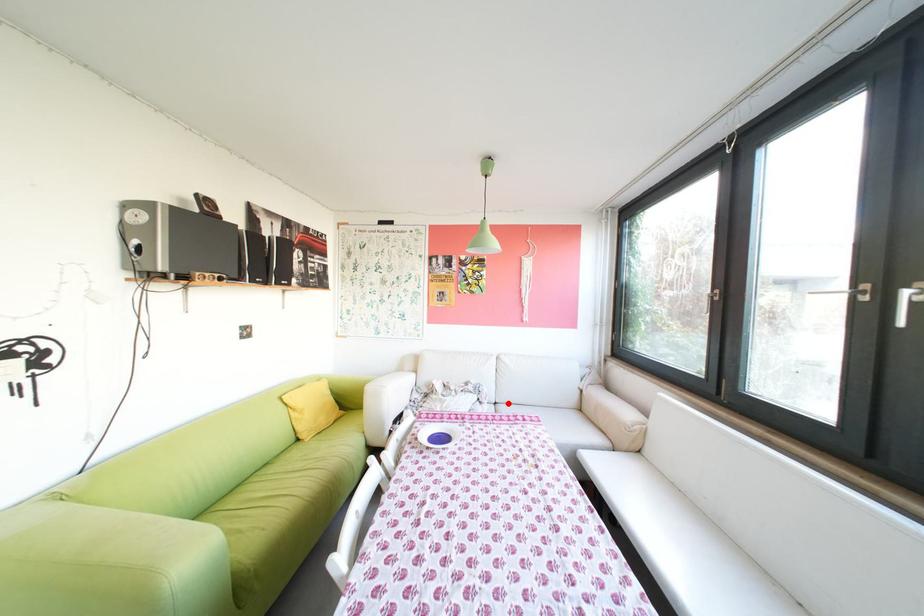
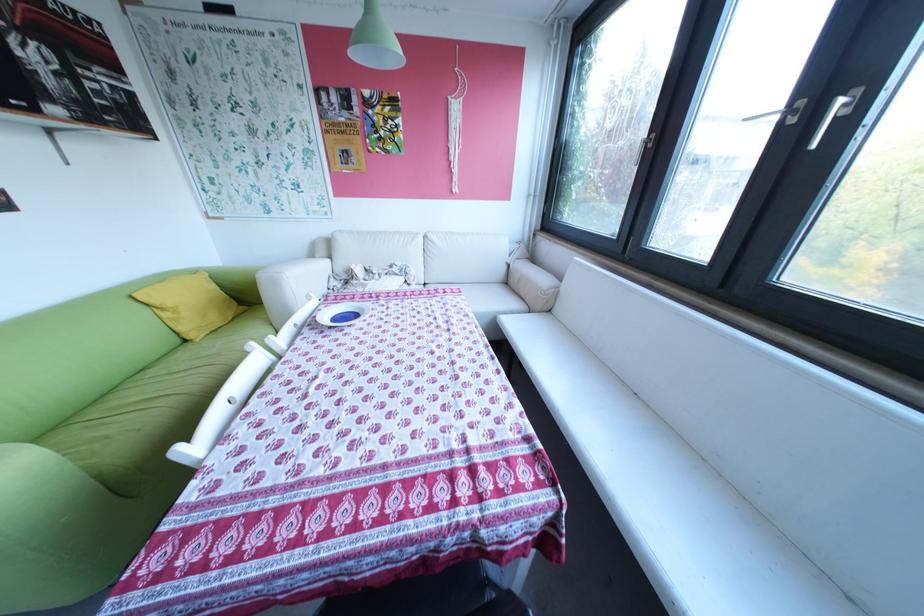
Question: I am providing you with two images of the same scene from different viewpoints. A red point is marked on the first image. At the location where the point appears in image 1, is it still visible in image 2?

Choices:
 (A) Yes
 (B) No

Answer: (A)